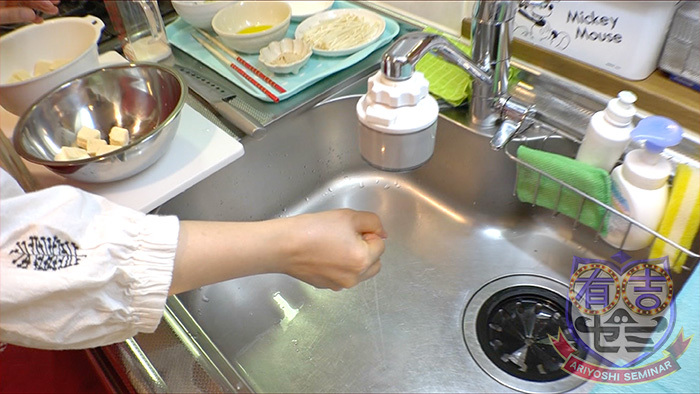
Identify the location of silver bowl. point(117,158).